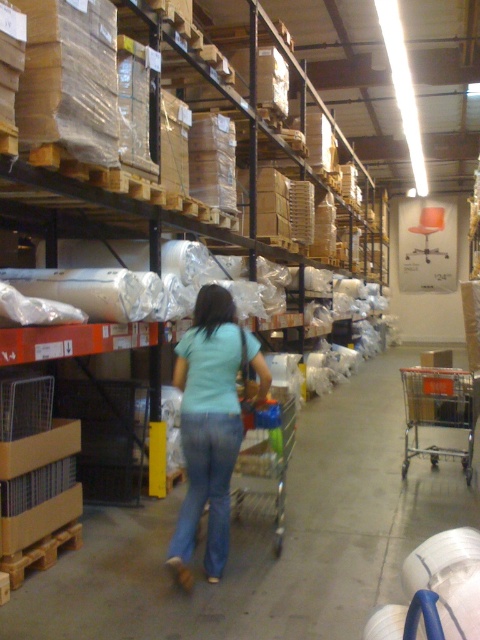
You are a store employee who needs to restock the shelves. You have a blue denim jeans at center and a metallic silver trolley at center. Which item takes up more space in the storage area?

The metallic silver trolley at center takes up more space in the storage area because the blue denim jeans at center occupies less space than metallic silver trolley at center.